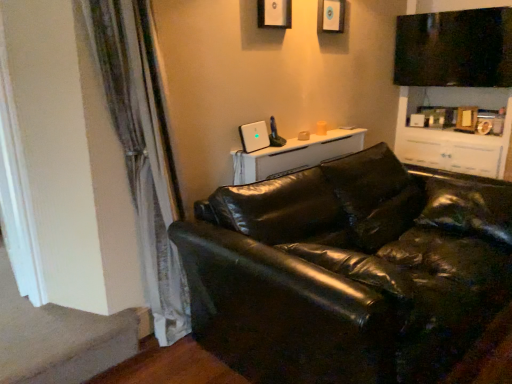
At what (x,y) coordinates should I click in order to perform the action: click on black leather couch at lower right. Please return your answer as a coordinate pair (x, y). The image size is (512, 384). Looking at the image, I should click on (348, 272).

In order to face white glossy table at upper center, should I rotate leftwards or rightwards?

Rotate your view right by about 7.105°.

Describe the element at coordinates (58, 338) in the screenshot. I see `carpet at lower left` at that location.

Identify the location of matte black picture frame at upper center, which is the second picture frame in right-to-left order. Image resolution: width=512 pixels, height=384 pixels. (274, 13).

This screenshot has height=384, width=512. What are the coordinates of `black leather couch at lower right` in the screenshot? It's located at (348, 272).

Which of these two, white glossy table at upper center or matte black picture frame at upper center, which is counted as the 1th picture frame, starting from the left, is bigger?

white glossy table at upper center.

From a real-world perspective, who is located lower, white glossy table at upper center or matte black picture frame at upper center, which is the second picture frame in right-to-left order?

white glossy table at upper center.

Considering the relative sizes of white glossy table at upper center and matte black picture frame at upper center, which is counted as the 1th picture frame, starting from the front, in the image provided, is white glossy table at upper center shorter than matte black picture frame at upper center, which is counted as the 1th picture frame, starting from the front,?

Correct, white glossy table at upper center is not as tall as matte black picture frame at upper center, which is counted as the 1th picture frame, starting from the front.

From the picture: Which is correct: white glossy table at upper center is inside matte black picture frame at upper center, the 2th picture frame when ordered from back to front, or outside of it?

white glossy table at upper center is located beyond the bounds of matte black picture frame at upper center, the 2th picture frame when ordered from back to front.

In the image, is matte white picture frame at upper center, arranged as the first picture frame when viewed from the right, positioned in front of or behind black leather couch at lower right?

matte white picture frame at upper center, arranged as the first picture frame when viewed from the right, is behind black leather couch at lower right.

You are a GUI agent. You are given a task and a screenshot of the screen. Output one action in this format:
    pyautogui.click(x=<x>, y=<y>)
    Task: Click on the studio couch below the matte white picture frame at upper center, the second picture frame when ordered from left to right (from a real-world perspective)
    
    Given the screenshot: What is the action you would take?
    pyautogui.click(x=348, y=272)

In the scene shown: From their relative heights in the image, would you say matte white picture frame at upper center, the 1th picture frame positioned from the back, is taller or shorter than black leather couch at lower right?

Considering their sizes, matte white picture frame at upper center, the 1th picture frame positioned from the back, has less height than black leather couch at lower right.

Is matte white picture frame at upper center, arranged as the first picture frame when viewed from the right, thinner than black leather couch at lower right?

Yes, matte white picture frame at upper center, arranged as the first picture frame when viewed from the right, is thinner than black leather couch at lower right.

Considering the relative sizes of matte white picture frame at upper center, the 1th picture frame positioned from the back, and silky white curtain at left in the image provided, is matte white picture frame at upper center, the 1th picture frame positioned from the back, bigger than silky white curtain at left?

Incorrect, matte white picture frame at upper center, the 1th picture frame positioned from the back, is not larger than silky white curtain at left.

Are matte white picture frame at upper center, the 1th picture frame positioned from the back, and silky white curtain at left making contact?

They are not placed beside each other.

From a real-world perspective, is matte white picture frame at upper center, the second picture frame when ordered from left to right, positioned over silky white curtain at left based on gravity?

Yes, from a real-world perspective, matte white picture frame at upper center, the second picture frame when ordered from left to right, is on top of silky white curtain at left.

From the image's perspective, which object appears higher, matte white picture frame at upper center, arranged as the second picture frame when viewed from the front, or silky white curtain at left?

matte white picture frame at upper center, arranged as the second picture frame when viewed from the front, from the image's perspective.

Would you say matte black picture frame at upper center, which is the second picture frame in right-to-left order, is inside or outside carpet at lower left?

matte black picture frame at upper center, which is the second picture frame in right-to-left order, is spatially situated outside carpet at lower left.

Which point is more forward, (262, 15) or (58, 325)?

Positioned in front is point (58, 325).

Considering the relative sizes of matte black picture frame at upper center, which is counted as the 1th picture frame, starting from the front, and carpet at lower left in the image provided, is matte black picture frame at upper center, which is counted as the 1th picture frame, starting from the front, shorter than carpet at lower left?

In fact, matte black picture frame at upper center, which is counted as the 1th picture frame, starting from the front, may be taller than carpet at lower left.

Can you tell me how much matte black picture frame at upper center, which is counted as the 1th picture frame, starting from the front, and silky white curtain at left differ in facing direction?

0.0133 degrees.

Is matte black picture frame at upper center, which is counted as the 1th picture frame, starting from the front, at the right side of silky white curtain at left?

Correct, you'll find matte black picture frame at upper center, which is counted as the 1th picture frame, starting from the front, to the right of silky white curtain at left.

Which point is more forward, [275,5] or [160,161]?

The point [160,161] is in front.

Is silky white curtain at left completely or partially inside matte black picture frame at upper center, the 2th picture frame when ordered from back to front?

Definitely not — silky white curtain at left is not inside matte black picture frame at upper center, the 2th picture frame when ordered from back to front.

Does carpet at lower left contain black leather couch at lower right?

No.

Is carpet at lower left far from black leather couch at lower right?

Absolutely, carpet at lower left is distant from black leather couch at lower right.

Can you confirm if carpet at lower left is bigger than black leather couch at lower right?

Incorrect, carpet at lower left is not larger than black leather couch at lower right.

In the scene shown: Is carpet at lower left wider than black leather couch at lower right?

Incorrect, the width of carpet at lower left does not surpass that of black leather couch at lower right.

From the image's perspective, which is above, matte white picture frame at upper center, arranged as the second picture frame when viewed from the front, or matte black picture frame at upper center, which is counted as the 1th picture frame, starting from the front?

From the image's view, matte white picture frame at upper center, arranged as the second picture frame when viewed from the front, is above.

In terms of height, does matte white picture frame at upper center, the 1th picture frame positioned from the back, look taller or shorter compared to matte black picture frame at upper center, the 2th picture frame when ordered from back to front?

Clearly, matte white picture frame at upper center, the 1th picture frame positioned from the back, is shorter compared to matte black picture frame at upper center, the 2th picture frame when ordered from back to front.

Which object is positioned more to the left, matte white picture frame at upper center, arranged as the first picture frame when viewed from the right, or matte black picture frame at upper center, which is counted as the 1th picture frame, starting from the front?

matte black picture frame at upper center, which is counted as the 1th picture frame, starting from the front.

From the image's perspective, which picture frame is the 1st one above the white glossy table at upper center? Please provide its 2D coordinates.

[(274, 13)]

Locate an element on the screen. The height and width of the screenshot is (384, 512). the 1st picture frame counting from the left side of the black leather couch at lower right is located at coordinates (332, 16).

Based on their spatial positions, is carpet at lower left or silky white curtain at left closer to matte black picture frame at upper center, the 2th picture frame when ordered from back to front?

silky white curtain at left lies closer to matte black picture frame at upper center, the 2th picture frame when ordered from back to front, than the other object.

From the image, which object appears to be farther from matte white picture frame at upper center, arranged as the first picture frame when viewed from the right, silky white curtain at left or black leather couch at lower right?

Among the two, black leather couch at lower right is located further to matte white picture frame at upper center, arranged as the first picture frame when viewed from the right.

Estimate the real-world distances between objects in this image. Which object is further from matte black picture frame at upper center, which is counted as the 1th picture frame, starting from the left, matte white picture frame at upper center, arranged as the first picture frame when viewed from the right, or black leather couch at lower right?

Based on the image, black leather couch at lower right appears to be further to matte black picture frame at upper center, which is counted as the 1th picture frame, starting from the left.

When comparing their distances from carpet at lower left, does white glossy table at upper center or silky white curtain at left seem closer?

Based on the image, silky white curtain at left appears to be nearer to carpet at lower left.

Considering their positions, is carpet at lower left positioned further to black leather couch at lower right than silky white curtain at left?

carpet at lower left is further to black leather couch at lower right.

From the image, which object appears to be farther from carpet at lower left, black leather couch at lower right or silky white curtain at left?

black leather couch at lower right.

Based on their spatial positions, is matte black picture frame at upper center, which is counted as the 1th picture frame, starting from the front, or carpet at lower left closer to black leather couch at lower right?

Based on the image, carpet at lower left appears to be nearer to black leather couch at lower right.

Looking at the image, which one is located closer to carpet at lower left, matte black picture frame at upper center, which is counted as the 1th picture frame, starting from the left, or matte white picture frame at upper center, the second picture frame when ordered from left to right?

matte black picture frame at upper center, which is counted as the 1th picture frame, starting from the left, is positioned closer to the anchor carpet at lower left.

Where is `curtain between black leather couch at lower right and white glossy table at upper center from front to back`? The width and height of the screenshot is (512, 384). curtain between black leather couch at lower right and white glossy table at upper center from front to back is located at coordinates (142, 154).

Identify the location of table located between carpet at lower left and black leather couch at lower right in the left-right direction. The height and width of the screenshot is (384, 512). (295, 155).

In order to click on curtain between black leather couch at lower right and matte white picture frame at upper center, arranged as the first picture frame when viewed from the right, along the z-axis in this screenshot , I will do `click(142, 154)`.

You are a GUI agent. You are given a task and a screenshot of the screen. Output one action in this format:
    pyautogui.click(x=<x>, y=<y>)
    Task: Click on the curtain that lies between matte black picture frame at upper center, which is counted as the 1th picture frame, starting from the front, and carpet at lower left from top to bottom
    Image resolution: width=512 pixels, height=384 pixels.
    Given the screenshot: What is the action you would take?
    pyautogui.click(x=142, y=154)